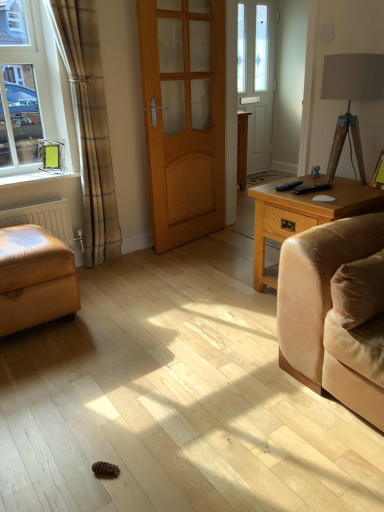
Identify the location of vacant location below wooden door at center (from a real-world perspective). (204, 234).